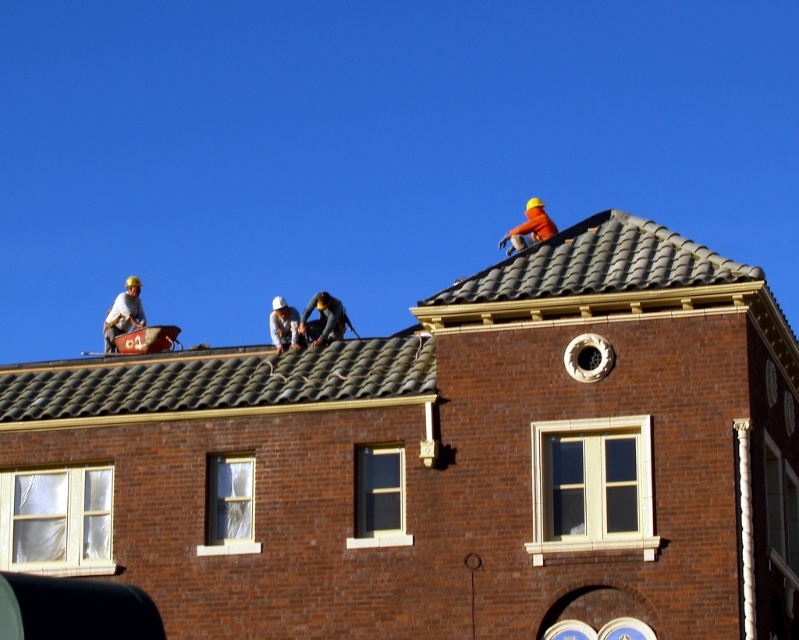
You are a construction worker standing on the roof of a brick building. You need to locate the dark gray fabric at center. Where should you look relative to the point marked at coordinates (324, 320)?

The point marked at coordinates (324, 320) corresponds exactly to the location of the dark gray fabric at center, so you should look directly at that point.